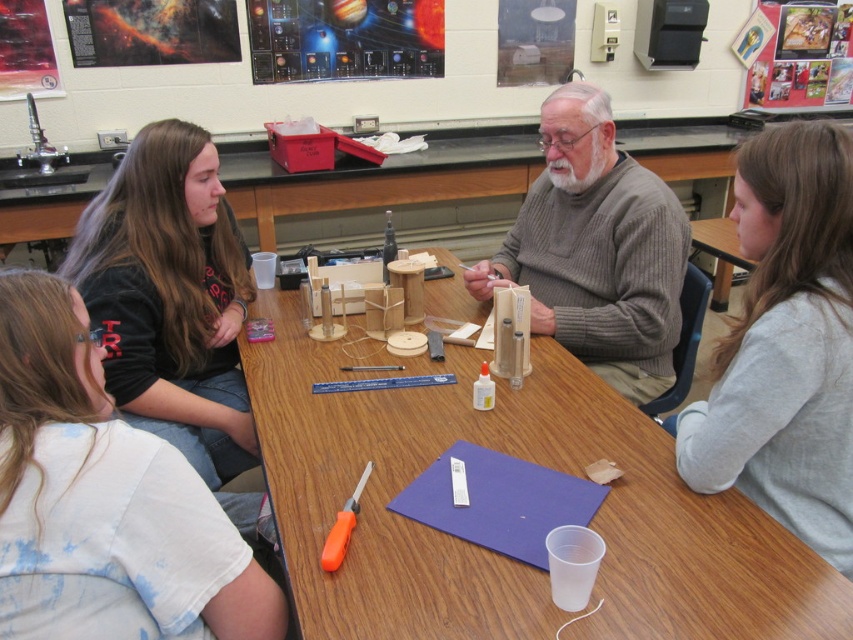
Can you confirm if wooden at center is taller than gray cotton shirt at upper right?

No, wooden at center is not taller than gray cotton shirt at upper right.

Does point (466, 308) come in front of point (831, 227)?

That is False.

Is point (596, 513) positioned in front of point (785, 177)?

No, it is behind (785, 177).

The height and width of the screenshot is (640, 853). I want to click on wooden at center, so click(x=491, y=552).

This screenshot has width=853, height=640. What do you see at coordinates (491, 552) in the screenshot? I see `wooden at center` at bounding box center [491, 552].

This screenshot has width=853, height=640. I want to click on wooden at center, so click(491, 552).

Find the location of `gray cotton shirt at upper right`. gray cotton shirt at upper right is located at coordinates (786, 344).

Does gray cotton shirt at upper right have a lesser height compared to orange plastic screwdriver at lower center?

No, gray cotton shirt at upper right is not shorter than orange plastic screwdriver at lower center.

Between point (817, 451) and point (344, 502), which one is positioned in front?

Point (817, 451) is in front.

Where is `gray cotton shirt at upper right`? gray cotton shirt at upper right is located at coordinates (786, 344).